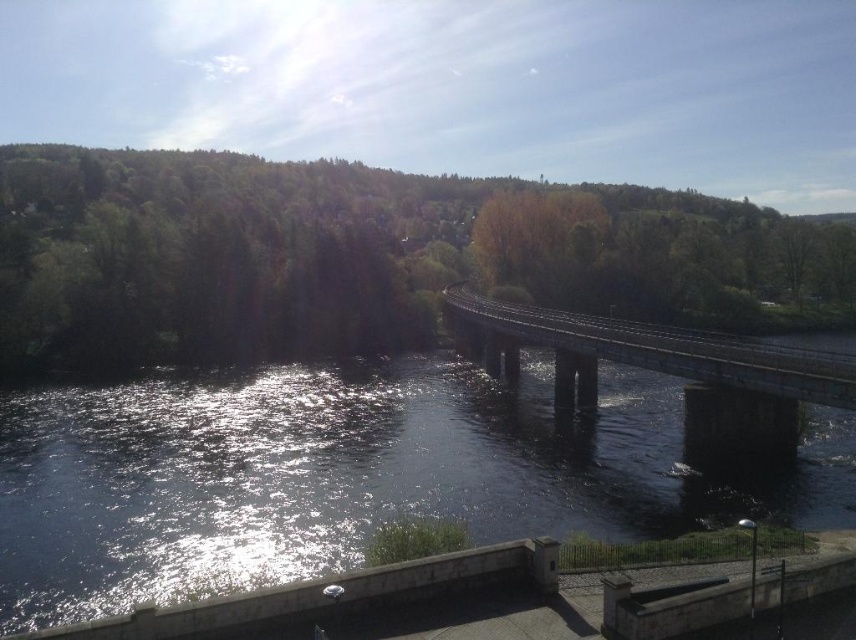
You are standing on the walkway and want to cross to the other side of the river. The dark gray concrete bridge at center is your only path. Can you see the dark blue water at center from where you are standing?

Yes, because the dark blue water at center is closer to the viewer than the dark gray concrete bridge at center, so the water is in front of the bridge and visible from your position on the walkway.

You are standing on the right bank of the river and want to cross to the left bank. There is a streetlamp near the wall on your side. Can you see the dark blue water at center from your current position?

Yes, the dark blue water at center is located at point (348, 474), which is within your line of sight from the right bank near the streetlamp.

In the scene shown: You are a photographer trying to capture the entire dark blue water at center and dark gray concrete bridge at center in one frame. Given that your camera has a fixed focal length, which object should you focus on first to ensure both are in the frame?

Since the dark blue water at center has a smaller size compared to dark gray concrete bridge at center, you should focus on the dark gray concrete bridge at center first to ensure both objects fit within the frame.